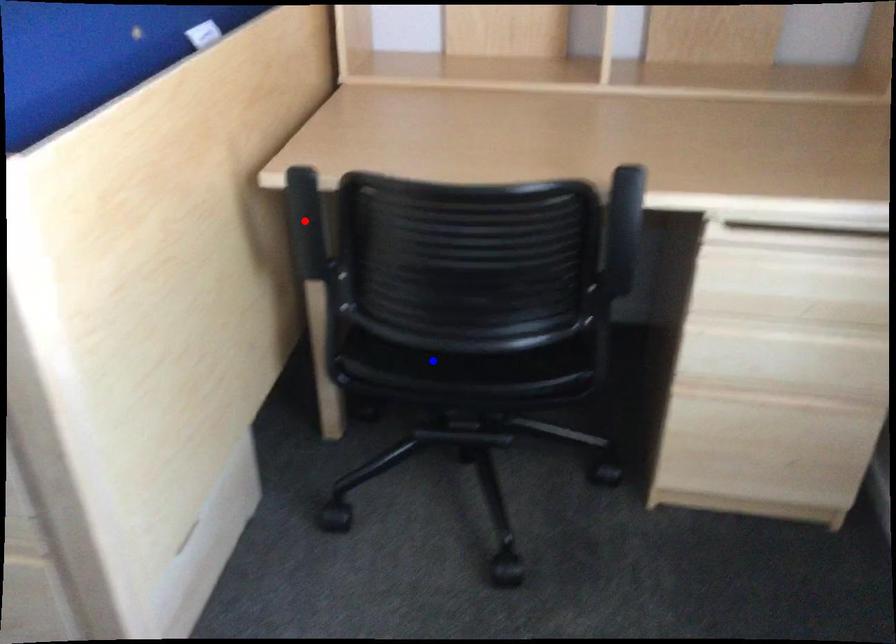
Question: Which of the two points in the image is closer to the camera?

Choices:
 (A) Blue point is closer.
 (B) Red point is closer.

Answer: (B)